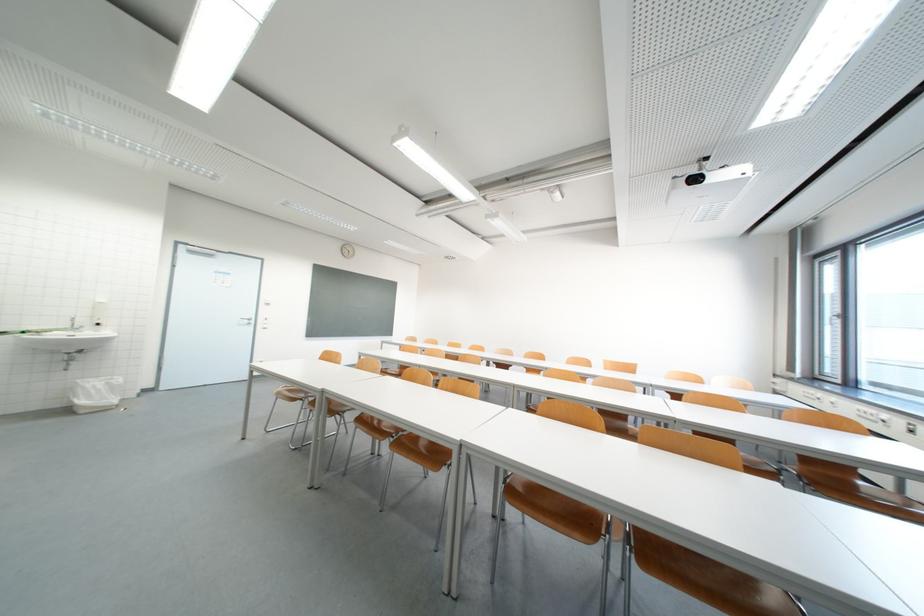
Find where to push the soap dispenser pump. Please return your answer as a coordinate pair (x, y).

(98, 314)